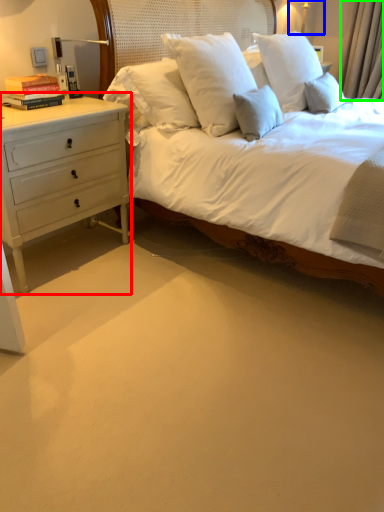
Question: Which object is positioned farthest from chest of drawers (highlighted by a red box)? Select from bedside lamp (highlighted by a blue box) and curtain (highlighted by a green box).

Choices:
 (A) bedside lamp
 (B) curtain

Answer: (A)